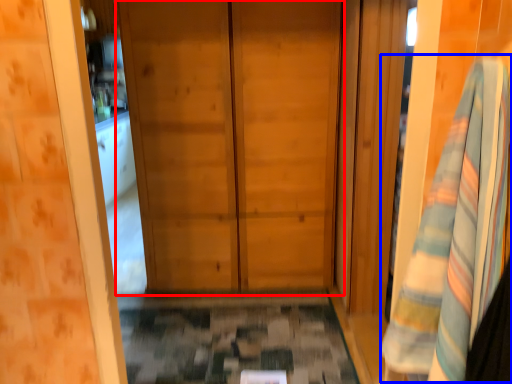
Question: Which object appears closest to the camera in this image, door (highlighted by a red box) or bath towel (highlighted by a blue box)?

Choices:
 (A) door
 (B) bath towel

Answer: (B)